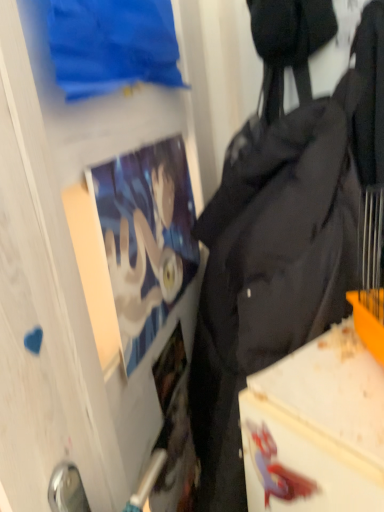
Question: Are transparent glass door at upper center and black fabric backpack at right far apart?

Choices:
 (A) no
 (B) yes

Answer: (A)

Question: Is transparent glass door at upper center at the right side of black fabric backpack at right?

Choices:
 (A) yes
 (B) no

Answer: (B)

Question: From a real-world perspective, is transparent glass door at upper center located higher than black fabric backpack at right?

Choices:
 (A) no
 (B) yes

Answer: (B)

Question: Considering the relative sizes of transparent glass door at upper center and black fabric backpack at right in the image provided, is transparent glass door at upper center bigger than black fabric backpack at right?

Choices:
 (A) yes
 (B) no

Answer: (B)

Question: Is transparent glass door at upper center facing away from black fabric backpack at right?

Choices:
 (A) yes
 (B) no

Answer: (A)

Question: Can you confirm if transparent glass door at upper center is thinner than black fabric backpack at right?

Choices:
 (A) no
 (B) yes

Answer: (B)

Question: Is the depth of matte paper poster at upper left greater than that of black fabric backpack at right?

Choices:
 (A) no
 (B) yes

Answer: (B)

Question: Is matte paper poster at upper left not within black fabric backpack at right?

Choices:
 (A) no
 (B) yes

Answer: (A)

Question: Considering the relative positions of matte paper poster at upper left and black fabric backpack at right in the image provided, is matte paper poster at upper left to the right of black fabric backpack at right from the viewer's perspective?

Choices:
 (A) yes
 (B) no

Answer: (B)

Question: From the image's perspective, is matte paper poster at upper left above black fabric backpack at right?

Choices:
 (A) no
 (B) yes

Answer: (B)

Question: Can you confirm if matte paper poster at upper left is smaller than black fabric backpack at right?

Choices:
 (A) yes
 (B) no

Answer: (A)

Question: Is matte paper poster at upper left directly adjacent to black fabric backpack at right?

Choices:
 (A) no
 (B) yes

Answer: (A)

Question: Can you confirm if matte paper poster at upper left is positioned to the right of transparent glass door at upper center?

Choices:
 (A) yes
 (B) no

Answer: (A)